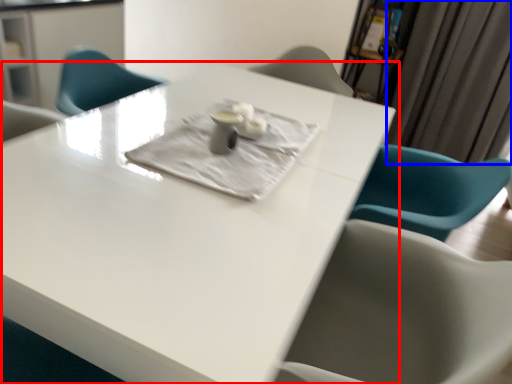
Question: Which point is further to the camera, table (highlighted by a red box) or curtain (highlighted by a blue box)?

Choices:
 (A) table
 (B) curtain

Answer: (B)